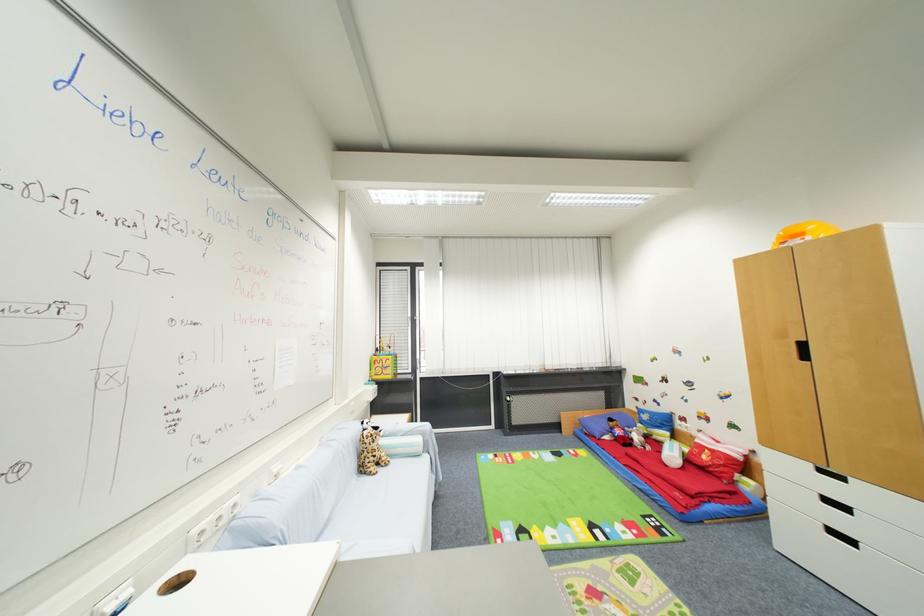
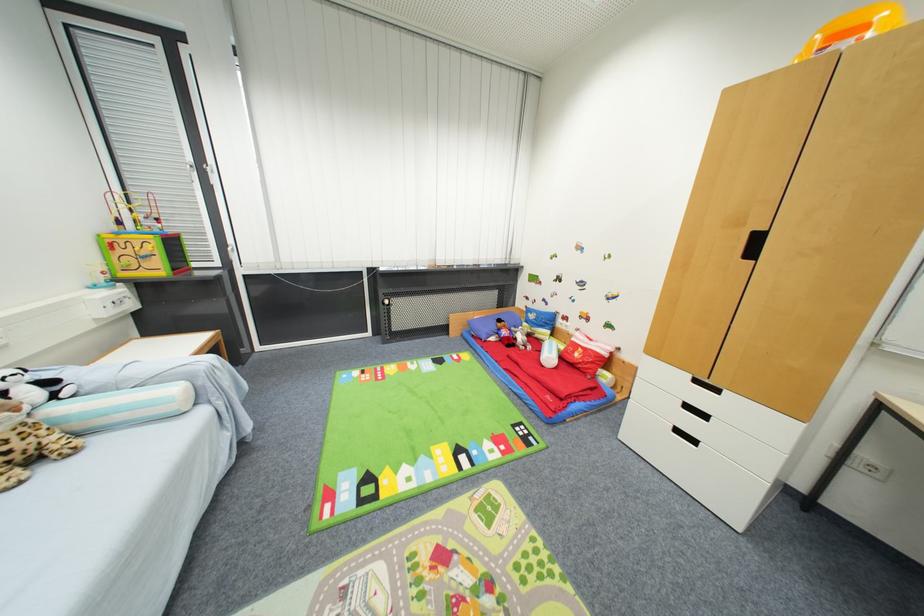
The point at (602, 437) is marked in the first image. Where is the corresponding point in the second image?

(488, 339)